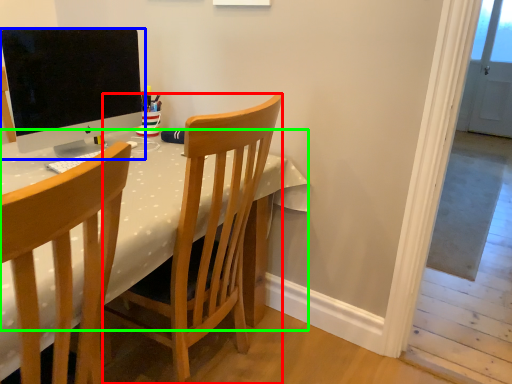
Question: Based on their relative distances, which object is farther from chair (highlighted by a red box)? Choose from computer monitor (highlighted by a blue box) and table (highlighted by a green box).

Choices:
 (A) computer monitor
 (B) table

Answer: (A)